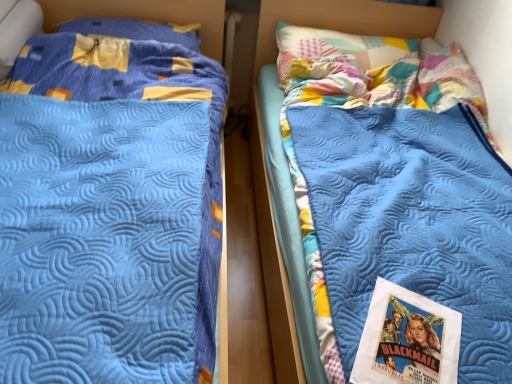
Question: Would you say blue quilted bed at left is a long distance from blue quilted pillow at upper left?

Choices:
 (A) no
 (B) yes

Answer: (A)

Question: Is blue quilted bed at left wider than blue quilted pillow at upper left?

Choices:
 (A) yes
 (B) no

Answer: (A)

Question: Can you confirm if blue quilted bed at left is bigger than blue quilted pillow at upper left?

Choices:
 (A) no
 (B) yes

Answer: (B)

Question: Does blue quilted bed at left appear on the left side of blue quilted pillow at upper left?

Choices:
 (A) yes
 (B) no

Answer: (B)

Question: Is blue quilted bed at left taller than blue quilted pillow at upper left?

Choices:
 (A) no
 (B) yes

Answer: (B)

Question: Considering the relative sizes of blue quilted bed at left and blue quilted pillow at upper left in the image provided, is blue quilted bed at left shorter than blue quilted pillow at upper left?

Choices:
 (A) no
 (B) yes

Answer: (A)

Question: Is matte paper poster at lower right to the left of blue quilted pillow at upper left from the viewer's perspective?

Choices:
 (A) yes
 (B) no

Answer: (B)

Question: Is matte paper poster at lower right directly adjacent to blue quilted pillow at upper left?

Choices:
 (A) no
 (B) yes

Answer: (A)

Question: Can you confirm if matte paper poster at lower right is positioned to the right of blue quilted pillow at upper left?

Choices:
 (A) no
 (B) yes

Answer: (B)

Question: Can you confirm if matte paper poster at lower right is wider than blue quilted pillow at upper left?

Choices:
 (A) yes
 (B) no

Answer: (B)

Question: Does matte paper poster at lower right contain blue quilted pillow at upper left?

Choices:
 (A) no
 (B) yes

Answer: (A)

Question: Can you confirm if matte paper poster at lower right is smaller than blue quilted pillow at upper left?

Choices:
 (A) no
 (B) yes

Answer: (B)

Question: Is matte paper poster at lower right outside blue quilted mattress at center?

Choices:
 (A) no
 (B) yes

Answer: (A)